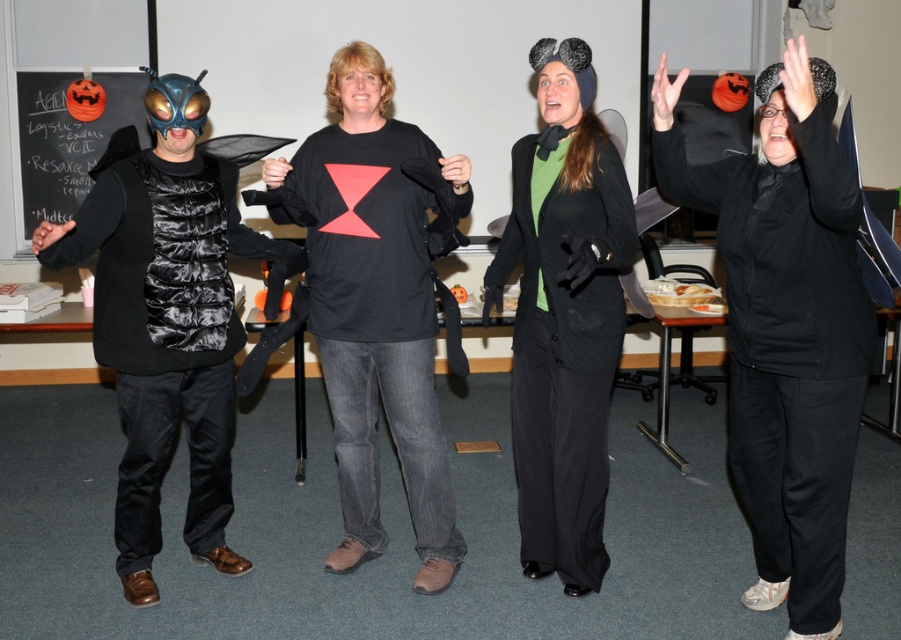
Can you confirm if matte black coat at center is wider than black chalkboard at upper left?

In fact, matte black coat at center might be narrower than black chalkboard at upper left.

Between matte black coat at center and black chalkboard at upper left, which one appears on the left side from the viewer's perspective?

Positioned to the left is black chalkboard at upper left.

The image size is (901, 640). I want to click on matte black coat at center, so click(x=563, y=344).

Between black matte pants at right and black chalkboard at upper left, which one appears on the right side from the viewer's perspective?

black matte pants at right is more to the right.

Is black matte pants at right positioned in front of black chalkboard at upper left?

Yes.

Identify the location of black matte pants at right. tap(787, 346).

Does black matte pants at right appear under matte black coat at center?

No.

Between black matte pants at right and matte black coat at center, which one has less height?

With less height is matte black coat at center.

What are the coordinates of `black matte pants at right` in the screenshot? It's located at (787, 346).

This screenshot has height=640, width=901. I want to click on black matte pants at right, so click(787, 346).